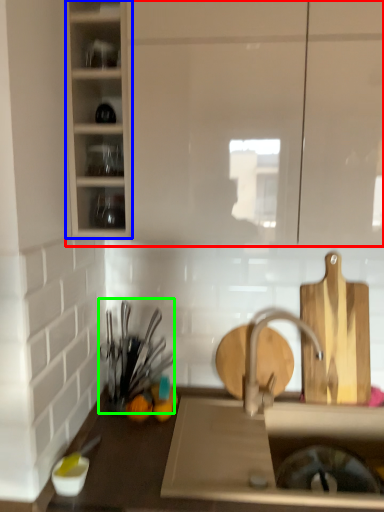
Question: Which object is the closest to the cabinetry (highlighted by a red box)? Choose among these: cabinetry (highlighted by a blue box) or tableware (highlighted by a green box).

Choices:
 (A) cabinetry
 (B) tableware

Answer: (A)